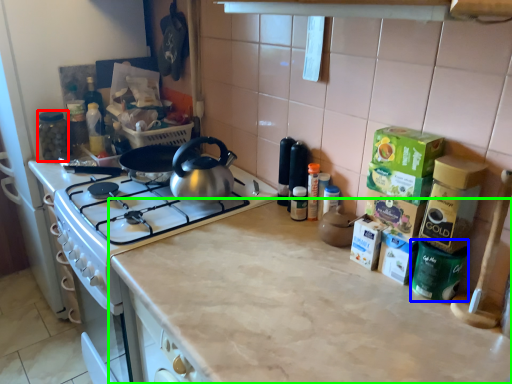
Question: Considering the real-world distances, which object is closest to appliance (highlighted by a red box)? appliance (highlighted by a blue box) or countertop (highlighted by a green box).

Choices:
 (A) appliance
 (B) countertop

Answer: (B)